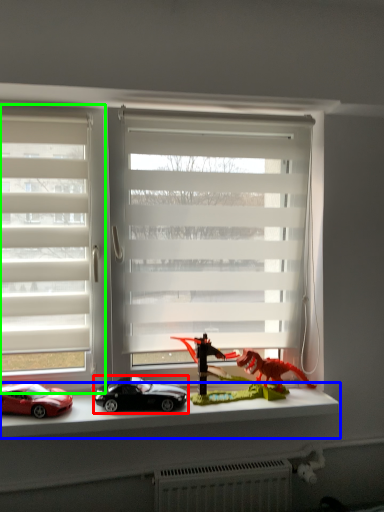
Question: Considering the real-world distances, which object is farthest from car (highlighted by a red box)? window sill (highlighted by a blue box) or window (highlighted by a green box)?

Choices:
 (A) window sill
 (B) window

Answer: (B)